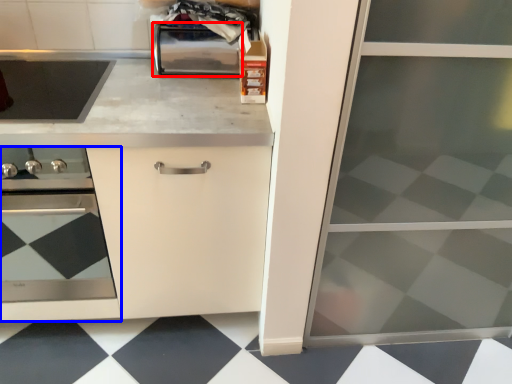
Question: Which of the following is the closest to the observer, toaster (highlighted by a red box) or home appliance (highlighted by a blue box)?

Choices:
 (A) toaster
 (B) home appliance

Answer: (B)